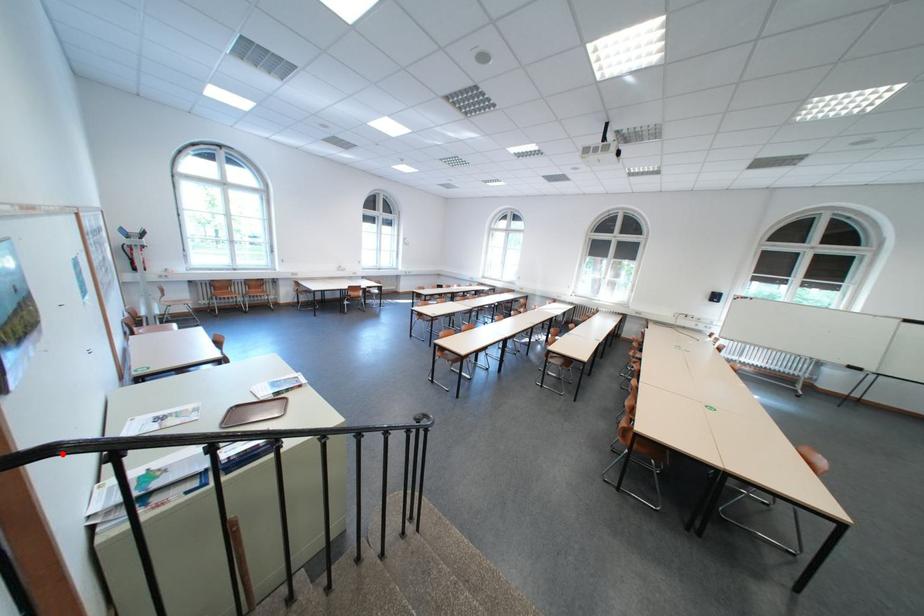
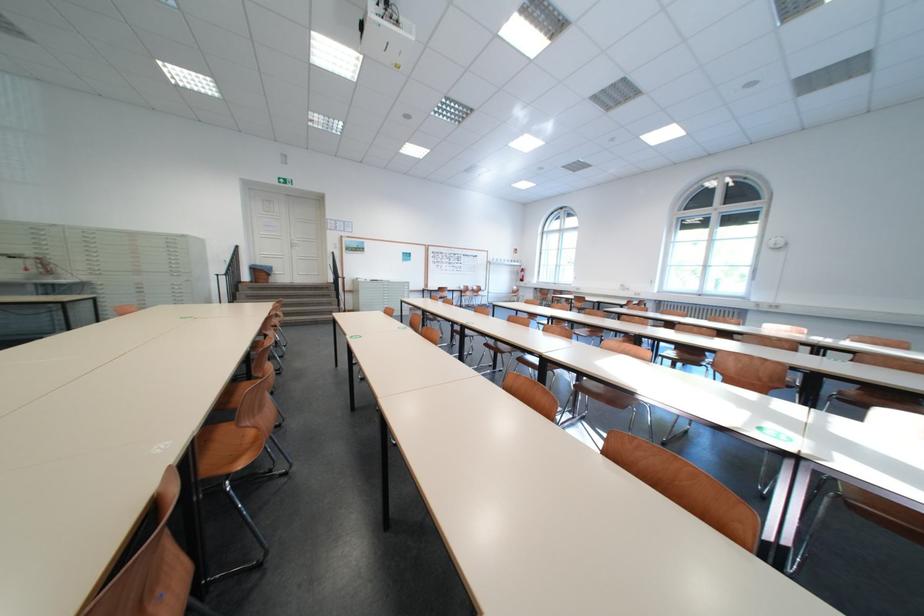
Question: I am providing you with two images of the same scene from different viewpoints. A red point is marked on the first image. At the location where the point appears in image 1, is it still visible in image 2?

Choices:
 (A) Yes
 (B) No

Answer: (B)